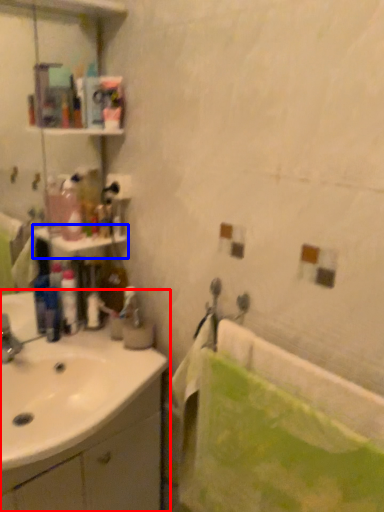
Question: Which object is closer to the camera taking this photo, sink (highlighted by a red box) or shelf (highlighted by a blue box)?

Choices:
 (A) sink
 (B) shelf

Answer: (A)